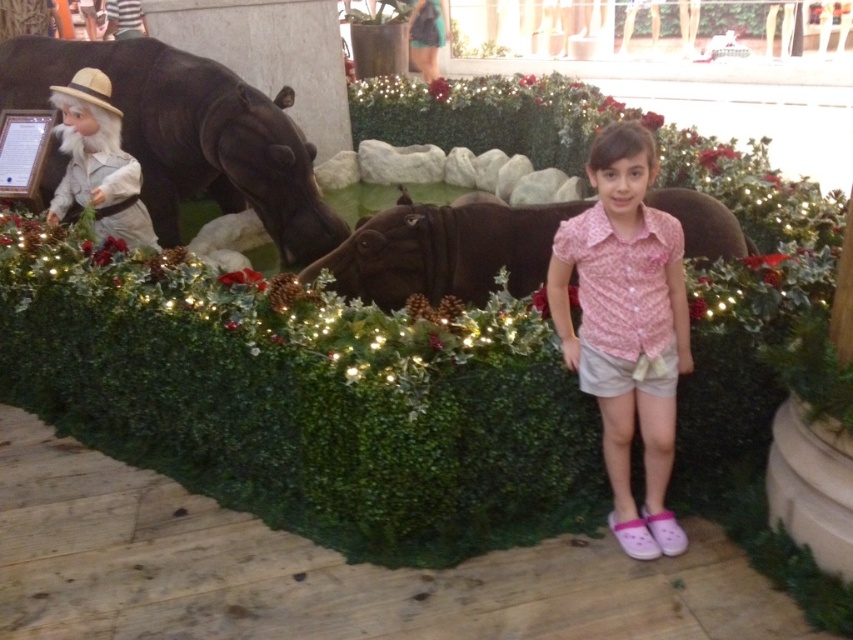
Question: Estimate the real-world distances between objects in this image. Which object is farther from the pink floral shirt at center?

Choices:
 (A) brown matte hippo at center
 (B) shiny black hippo at left

Answer: (B)

Question: Is pink floral shirt at center bigger than shiny black hippo at left?

Choices:
 (A) no
 (B) yes

Answer: (A)

Question: Among these points, which one is nearest to the camera?

Choices:
 (A) (57, 92)
 (B) (668, 193)

Answer: (B)

Question: Can you confirm if pink floral shirt at center is positioned below shiny black hippo at left?

Choices:
 (A) yes
 (B) no

Answer: (A)

Question: Based on their relative distances, which object is nearer to the shiny black hippo at left?

Choices:
 (A) pink floral shirt at center
 (B) white matte statue at left
 (C) brown matte hippo at center

Answer: (B)

Question: Can you confirm if brown matte hippo at center is positioned below white matte statue at left?

Choices:
 (A) no
 (B) yes

Answer: (B)